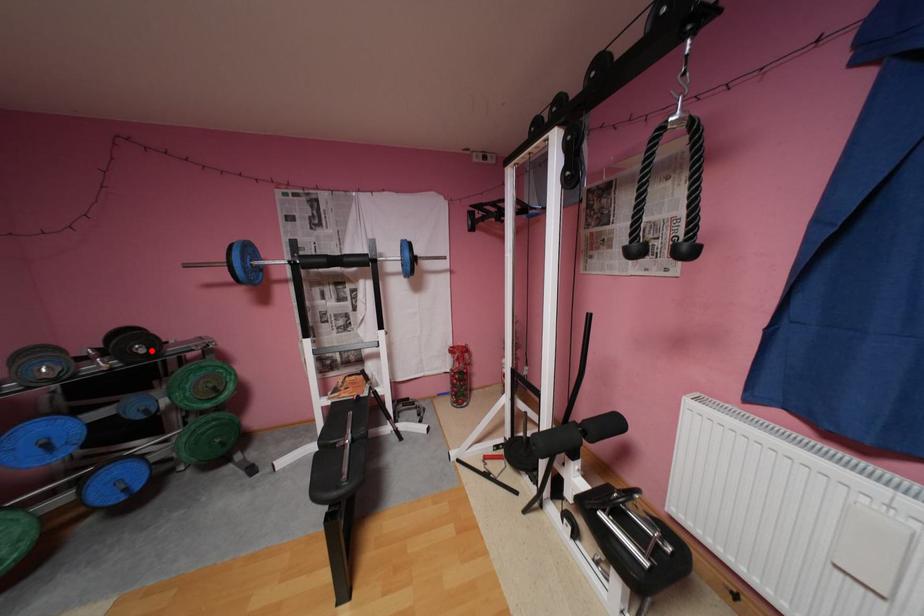
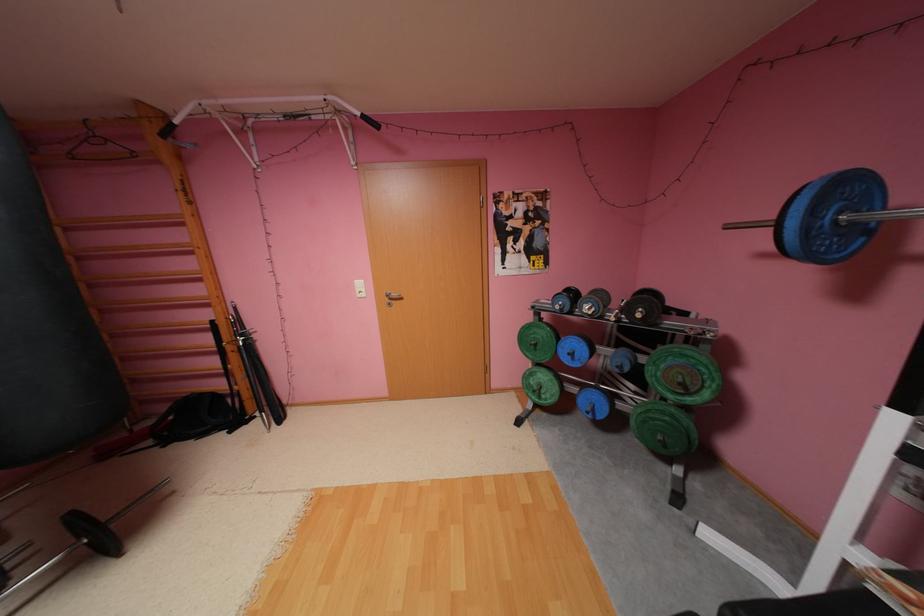
Where in the second image is the point corresponding to the highlighted location from the first image?

(648, 315)